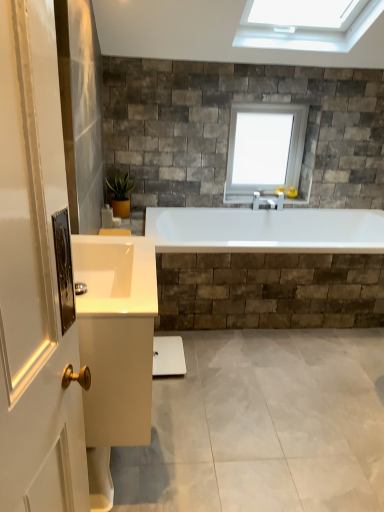
Question: From the image's perspective, is white glossy cabinet at lower left beneath white glass window at upper center?

Choices:
 (A) yes
 (B) no

Answer: (A)

Question: Considering the relative sizes of white glossy cabinet at lower left and white glass window at upper center in the image provided, is white glossy cabinet at lower left bigger than white glass window at upper center?

Choices:
 (A) yes
 (B) no

Answer: (A)

Question: Considering the relative sizes of white glossy cabinet at lower left and white glass window at upper center in the image provided, is white glossy cabinet at lower left smaller than white glass window at upper center?

Choices:
 (A) yes
 (B) no

Answer: (B)

Question: Does white glossy cabinet at lower left have a greater width compared to white glass window at upper center?

Choices:
 (A) no
 (B) yes

Answer: (B)

Question: Is white glossy cabinet at lower left at the left side of white glass window at upper center?

Choices:
 (A) yes
 (B) no

Answer: (A)

Question: From a real-world perspective, is white glossy sink at lower left positioned above or below white glass window at upper center?

Choices:
 (A) below
 (B) above

Answer: (A)

Question: Is white glossy sink at lower left situated inside white glass window at upper center or outside?

Choices:
 (A) outside
 (B) inside

Answer: (A)

Question: From the image's perspective, is white glossy sink at lower left located above or below white glass window at upper center?

Choices:
 (A) below
 (B) above

Answer: (A)

Question: Based on their sizes in the image, would you say white glossy sink at lower left is bigger or smaller than white glass window at upper center?

Choices:
 (A) big
 (B) small

Answer: (B)

Question: From a real-world perspective, is white glass window at upper center above or below white glossy sink at lower left?

Choices:
 (A) above
 (B) below

Answer: (A)

Question: Based on their sizes in the image, would you say white glass window at upper center is bigger or smaller than white glossy sink at lower left?

Choices:
 (A) big
 (B) small

Answer: (A)

Question: Is white glass window at upper center to the left or to the right of white glossy sink at lower left in the image?

Choices:
 (A) right
 (B) left

Answer: (A)

Question: Looking at their shapes, would you say white glass window at upper center is wider or thinner than white glossy sink at lower left?

Choices:
 (A) wide
 (B) thin

Answer: (B)

Question: In terms of width, does white glossy cabinet at lower left look wider or thinner when compared to white glass window at upper center?

Choices:
 (A) wide
 (B) thin

Answer: (A)

Question: From the image's perspective, relative to white glass window at upper center, is white glossy cabinet at lower left above or below?

Choices:
 (A) above
 (B) below

Answer: (B)